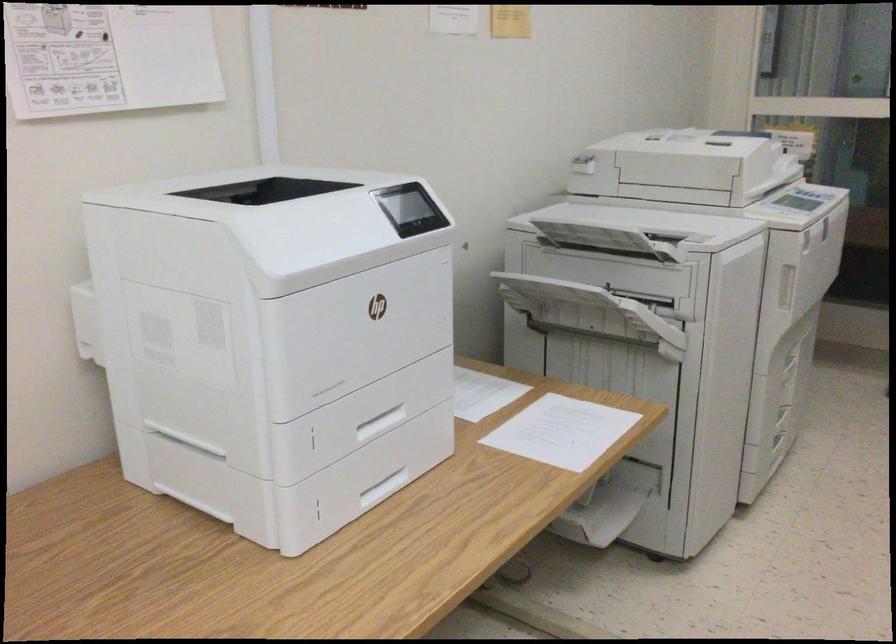
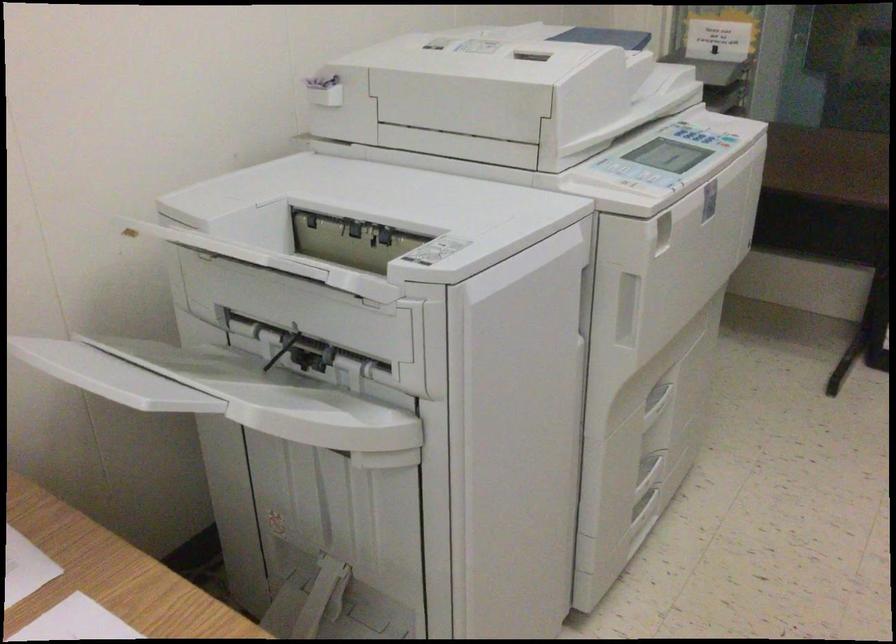
The point at (797, 202) is marked in the first image. Where is the corresponding point in the second image?

(668, 155)